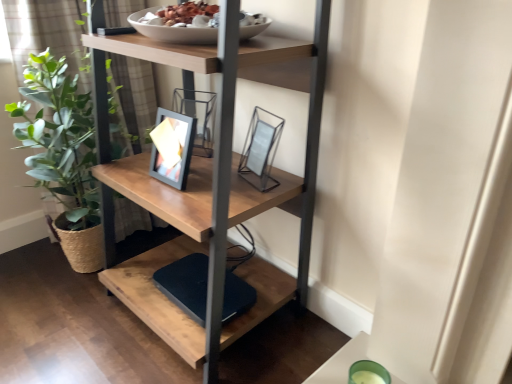
In order to face metallic glass picture frame at center, should I rotate leftwards or rightwards?

You should rotate right by 1.625 degrees.

Identify the location of wooden shelf at center. (210, 181).

I want to click on green leafy plant at left, so click(x=46, y=32).

Which of these two, green leafy plant at left or black matte lift at lower center, stands shorter?

black matte lift at lower center is shorter.

Can we say green leafy plant at left lies outside black matte lift at lower center?

That's correct, green leafy plant at left is outside of black matte lift at lower center.

Is green leafy plant at left oriented away from black matte lift at lower center?

No.

Does green leafy plant at left appear on the right side of black matte lift at lower center?

In fact, green leafy plant at left is to the left of black matte lift at lower center.

Is metallic glass picture frame at center oriented away from wooden shelf at center?

Yes, metallic glass picture frame at center is facing away from wooden shelf at center.

Can you confirm if metallic glass picture frame at center is positioned to the left of wooden shelf at center?

In fact, metallic glass picture frame at center is to the right of wooden shelf at center.

In the scene shown: From the image's perspective, who appears lower, metallic glass picture frame at center or wooden shelf at center?

wooden shelf at center appears lower in the image.

Measure the distance between metallic glass picture frame at center and wooden shelf at center.

The distance of metallic glass picture frame at center from wooden shelf at center is 10.00 inches.

Is metallic glass picture frame at center placed right next to green leafy plant at left?

No, metallic glass picture frame at center is not making contact with green leafy plant at left.

Is point (270, 168) positioned before point (149, 67)?

Yes, it is.

From a real-world perspective, relative to green leafy plant at left, is metallic glass picture frame at center vertically above or below?

metallic glass picture frame at center is above green leafy plant at left.

Consider the image. Would you say metallic glass picture frame at center is outside green leafy plant at left?

Yes, metallic glass picture frame at center is located beyond the bounds of green leafy plant at left.

Image resolution: width=512 pixels, height=384 pixels. Find the location of `houseplant above the black matte lift at lower center (from the image's perspective)`. houseplant above the black matte lift at lower center (from the image's perspective) is located at coordinates (46, 32).

Is black matte lift at lower center completely or partially outside of green leafy plant at left?

Yes, black matte lift at lower center is outside of green leafy plant at left.

Looking at the image, does black matte lift at lower center seem bigger or smaller compared to green leafy plant at left?

Considering their sizes, black matte lift at lower center takes up less space than green leafy plant at left.

Considering the positions of point (160, 286) and point (74, 3), is point (160, 286) closer or farther from the camera than point (74, 3)?

Clearly, point (160, 286) is closer to the camera than point (74, 3).

Considering the relative sizes of metallic glass picture frame at center and black matte lift at lower center in the image provided, is metallic glass picture frame at center shorter than black matte lift at lower center?

In fact, metallic glass picture frame at center may be taller than black matte lift at lower center.

From the image's perspective, is metallic glass picture frame at center positioned above or below black matte lift at lower center?

metallic glass picture frame at center is above black matte lift at lower center.

In the scene shown: Is metallic glass picture frame at center in front of black matte lift at lower center?

Yes, the depth of metallic glass picture frame at center is less than that of black matte lift at lower center.

Is green leafy plant at left positioned with its back to wooden shelf at center?

Yes, wooden shelf at center is at the back of green leafy plant at left.

Is green leafy plant at left touching wooden shelf at center?

No, green leafy plant at left is not beside wooden shelf at center.

Does point (79, 35) appear closer or farther from the camera than point (284, 179)?

Point (79, 35).

Which object is positioned more to the left, green leafy plant at left or wooden shelf at center?

Positioned to the left is green leafy plant at left.

Would you say green leafy plant at left is inside or outside metallic glass picture frame at center?

green leafy plant at left lies outside metallic glass picture frame at center.

Identify the location of picture frame lying in front of the green leafy plant at left. This screenshot has width=512, height=384. (260, 150).

Between green leafy plant at left and metallic glass picture frame at center, which one has more height?

With more height is green leafy plant at left.

Is metallic glass picture frame at center at the back of green leafy plant at left?

No, green leafy plant at left is not facing away from metallic glass picture frame at center.

There is a black matte lift at lower center. In order to click on houseplant above it (from a real-world perspective) in this screenshot , I will do coord(46,32).

This screenshot has height=384, width=512. I want to click on shelf that appears on the left of metallic glass picture frame at center, so click(210, 181).

Consider the image. Considering their positions, is metallic glass picture frame at center positioned further to wooden shelf at center than green leafy plant at left?

green leafy plant at left is positioned further to the anchor wooden shelf at center.

Considering their positions, is black matte lift at lower center positioned further to green leafy plant at left than metallic glass picture frame at center?

black matte lift at lower center.

Based on the photo, from the image, which object appears to be farther from metallic glass picture frame at center, wooden shelf at center or green leafy plant at left?

green leafy plant at left is further to metallic glass picture frame at center.

From the image, which object appears to be nearer to metallic glass picture frame at center, black matte lift at lower center or green leafy plant at left?

black matte lift at lower center is closer to metallic glass picture frame at center.

From the image, which object appears to be farther from green leafy plant at left, metallic glass picture frame at center or wooden shelf at center?

metallic glass picture frame at center.

Estimate the real-world distances between objects in this image. Which object is further from metallic glass picture frame at center, wooden shelf at center or black matte lift at lower center?

black matte lift at lower center is positioned further to the anchor metallic glass picture frame at center.

Which object lies nearer to the anchor point green leafy plant at left, wooden shelf at center or black matte lift at lower center?

The object closer to green leafy plant at left is wooden shelf at center.

From the image, which object appears to be farther from metallic glass picture frame at center, green leafy plant at left or black matte lift at lower center?

green leafy plant at left is positioned further to the anchor metallic glass picture frame at center.

The image size is (512, 384). Identify the location of lift between wooden shelf at center and green leafy plant at left in the front-back direction. (186, 284).

Find the location of a particular element. Image resolution: width=512 pixels, height=384 pixels. picture frame between wooden shelf at center and black matte lift at lower center from front to back is located at coordinates (260, 150).

The image size is (512, 384). I want to click on lift situated between green leafy plant at left and metallic glass picture frame at center from left to right, so click(x=186, y=284).

Find the location of a particular element. The image size is (512, 384). shelf between green leafy plant at left and metallic glass picture frame at center in the horizontal direction is located at coordinates [210, 181].